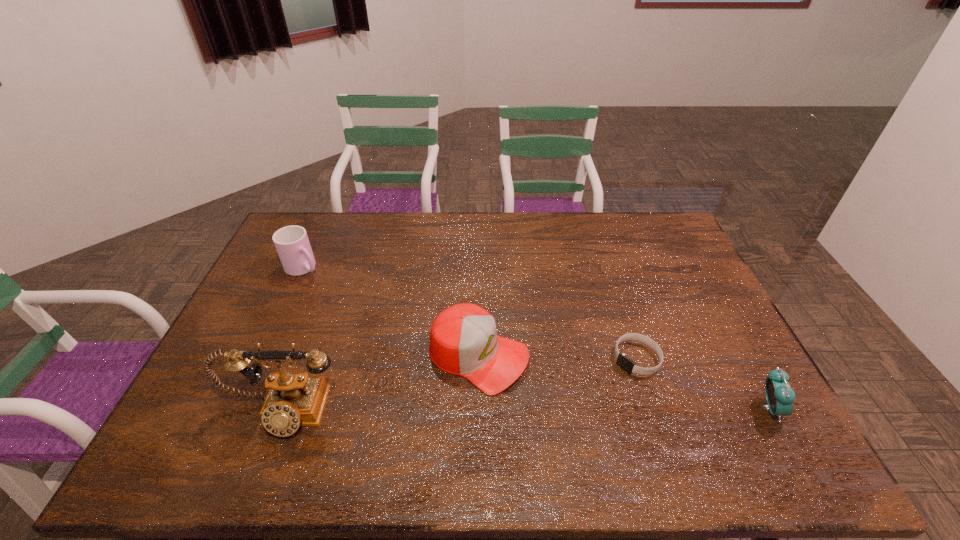
This screenshot has height=540, width=960. Identify the location of free space on the desktop that is between the telephone and the alarm clock and is positioned with the handle on the side of the cup. (494, 410).

The width and height of the screenshot is (960, 540). Find the location of `free spot on the desktop that is between the telephone and the rightmost object and is positioned on the outer surface of the shortest object`. free spot on the desktop that is between the telephone and the rightmost object and is positioned on the outer surface of the shortest object is located at coordinates pyautogui.click(x=574, y=409).

This screenshot has width=960, height=540. I want to click on free spot on the desktop that is between the telephone and the rightmost object and is positioned on the front-facing side of the baseball cap, so click(584, 409).